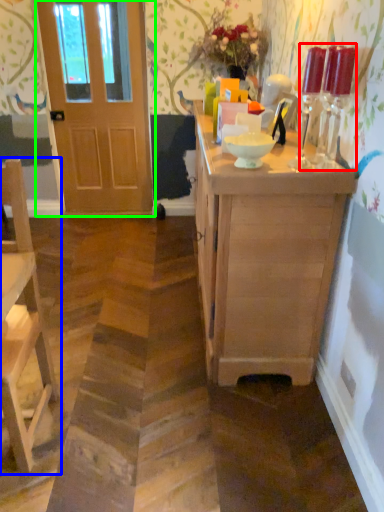
Question: Which object is the closest to the candle holder (highlighted by a red box)? Choose among these: chair (highlighted by a blue box) or door (highlighted by a green box).

Choices:
 (A) chair
 (B) door

Answer: (A)